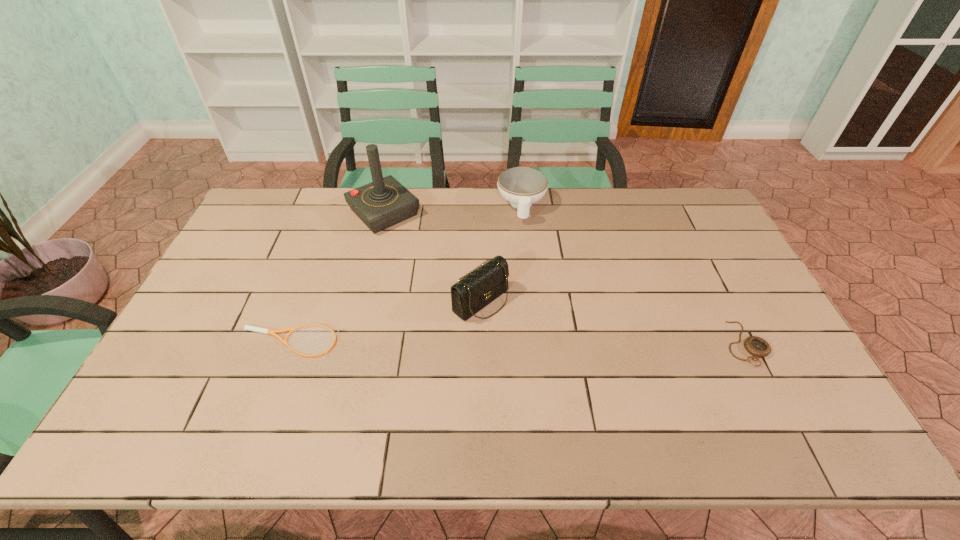
The image size is (960, 540). What are the coordinates of `free region located 0.400m on the side with the handle of the chinaware` in the screenshot? It's located at (529, 316).

Find the location of a particular element. The height and width of the screenshot is (540, 960). vacant area situated 0.070m on the front flap of the second tallest object is located at coordinates (519, 330).

This screenshot has width=960, height=540. I want to click on free location located 0.270m on the front flap of the second tallest object, so click(x=578, y=377).

Find the location of a particular element. The height and width of the screenshot is (540, 960). vacant region located on the front flap of the second tallest object is located at coordinates (601, 395).

What are the coordinates of `vacant region located on the rectangular base of the joystick` in the screenshot? It's located at (426, 253).

At what (x,y) coordinates should I click in order to perform the action: click on free region located on the rectangular base of the joystick. Please return your answer as a coordinate pair (x, y). This screenshot has height=540, width=960. Looking at the image, I should click on (415, 242).

Locate an element on the screen. vacant area situated on the rectangular base of the joystick is located at coordinates (471, 298).

Where is `chinaware present at the far edge`? This screenshot has height=540, width=960. chinaware present at the far edge is located at coordinates (521, 186).

Where is `joystick at the far edge`? This screenshot has height=540, width=960. joystick at the far edge is located at coordinates (385, 202).

I want to click on object that is at the right edge, so click(756, 346).